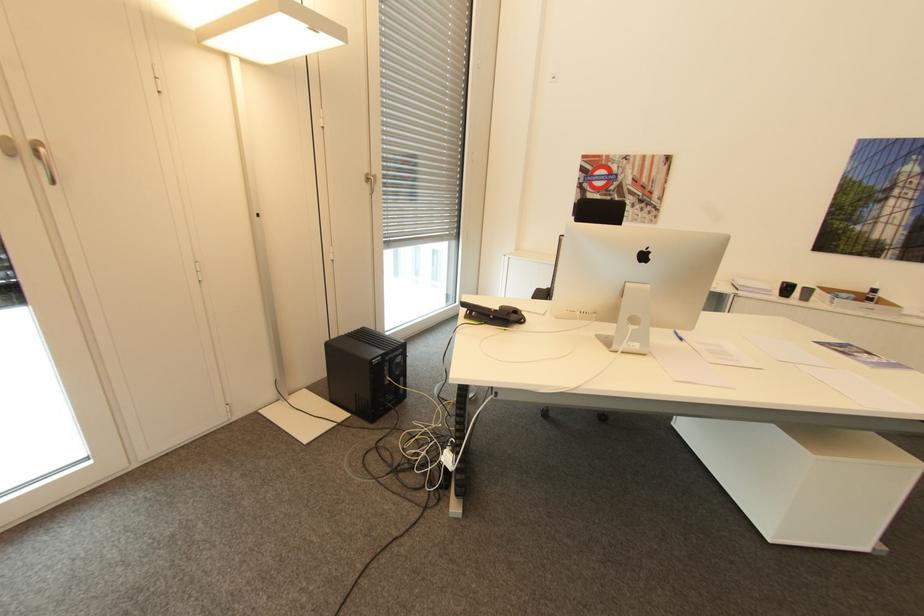
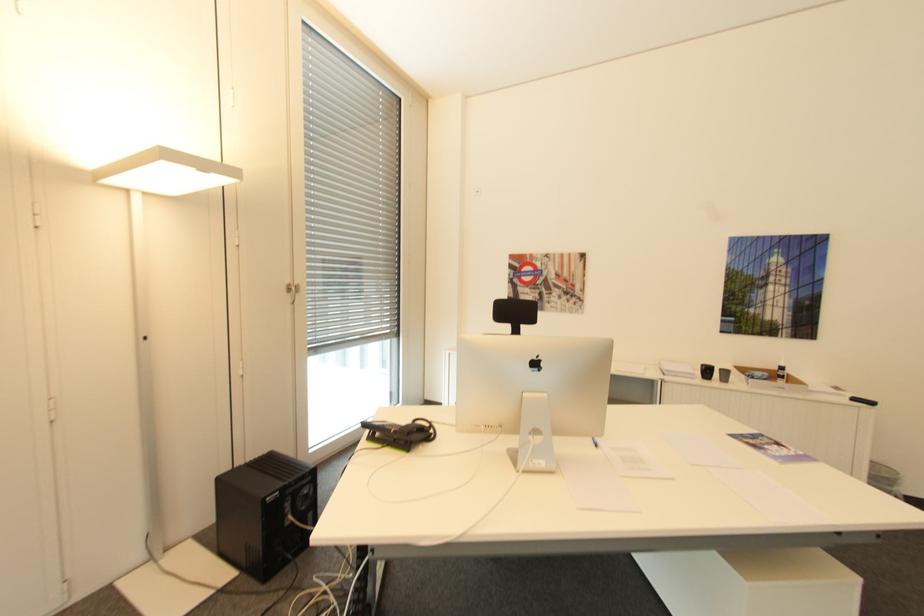
Question: In a continuous first-person perspective shot, in which direction is the camera moving?

Choices:
 (A) Left
 (B) Right
 (C) Forward
 (D) Backward

Answer: (B)